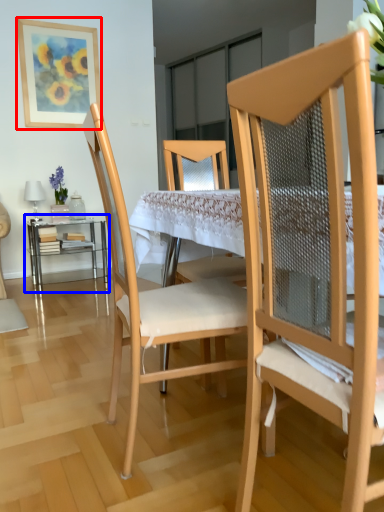
Question: Which of the following is the farthest to the observer, picture frame (highlighted by a red box) or table (highlighted by a blue box)?

Choices:
 (A) picture frame
 (B) table

Answer: (A)